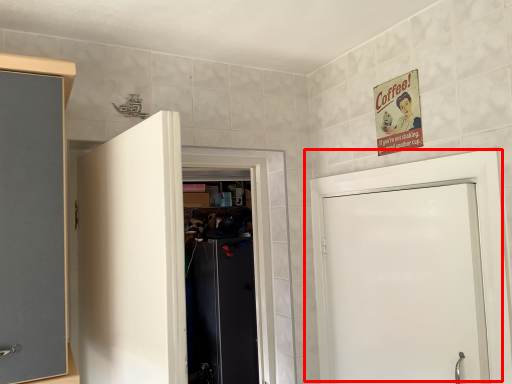
Question: Observing the image, what is the correct spatial positioning of door (annotated by the red box) in reference to door?

Choices:
 (A) right
 (B) left

Answer: (A)